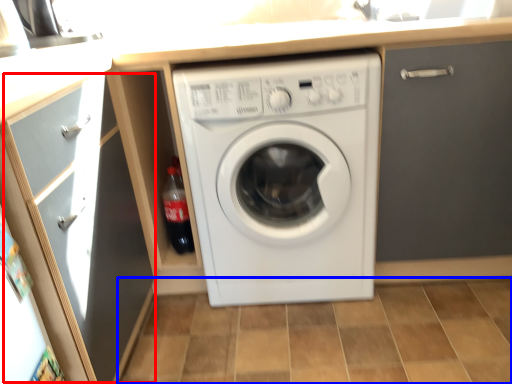
Question: Which point is closer to the camera, glass door (highlighted by a red box) or tile (highlighted by a blue box)?

Choices:
 (A) glass door
 (B) tile

Answer: (A)